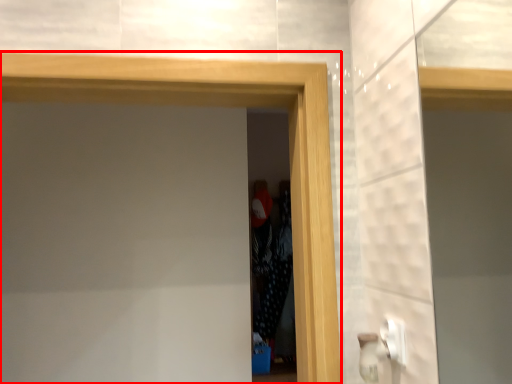
Question: Where is screen door (annotated by the red box) located in relation to screen door in the image?

Choices:
 (A) left
 (B) right

Answer: (A)